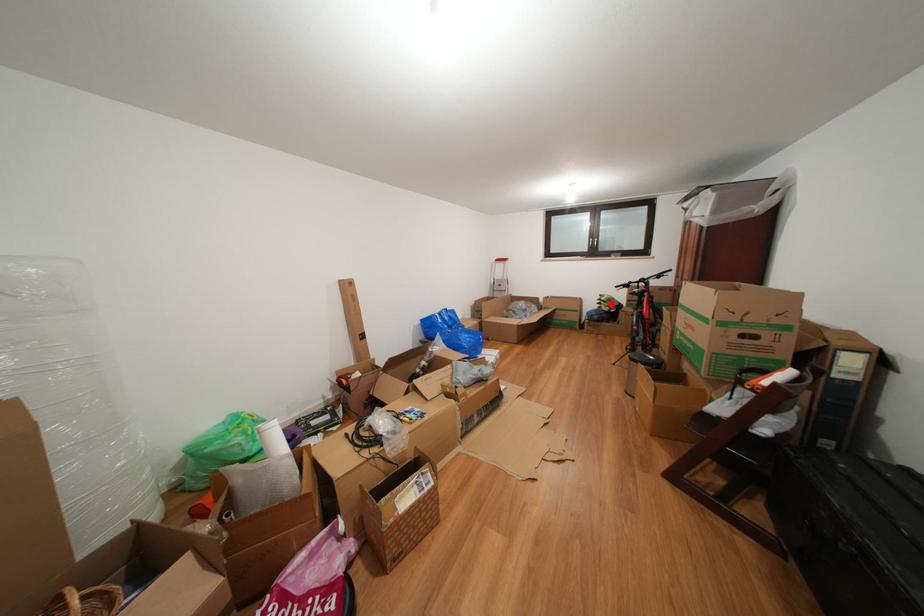
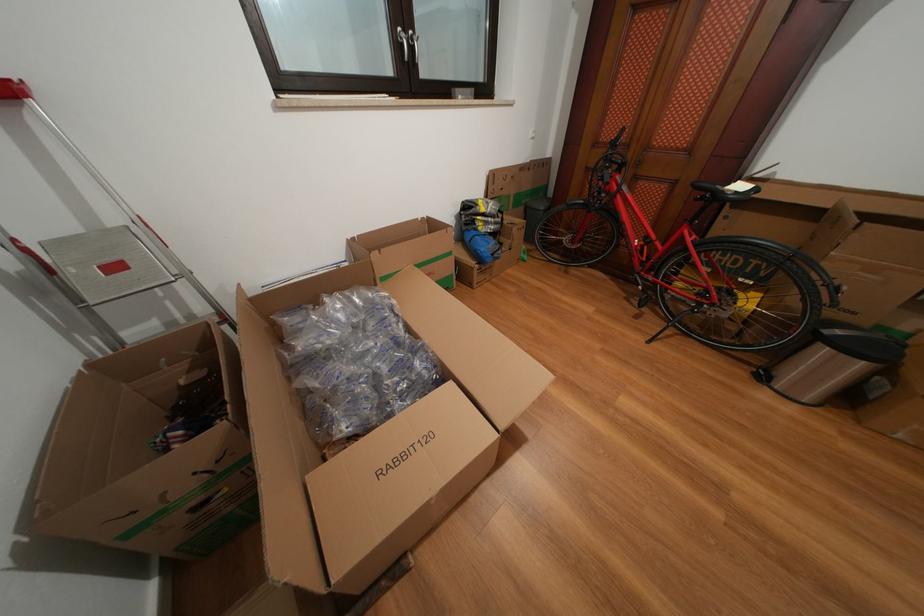
Question: I am providing you with two images of the same scene from different viewpoints. Image1 has a red point marked. In image2, the corresponding 3D location appears at what relative position? Reply with the corresponding letter.

Choices:
 (A) Closer
 (B) Farther

Answer: (A)